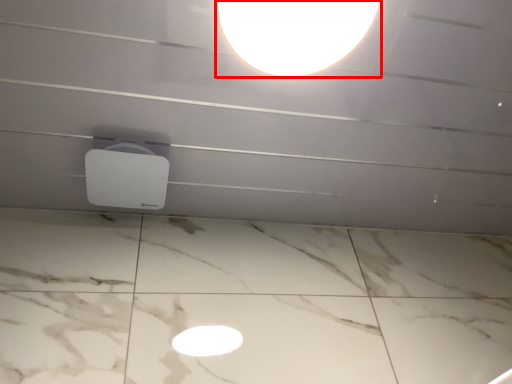
Question: From the image's perspective, what is the correct spatial positioning of lamp (annotated by the red box) in reference to lamp?

Choices:
 (A) below
 (B) above

Answer: (B)